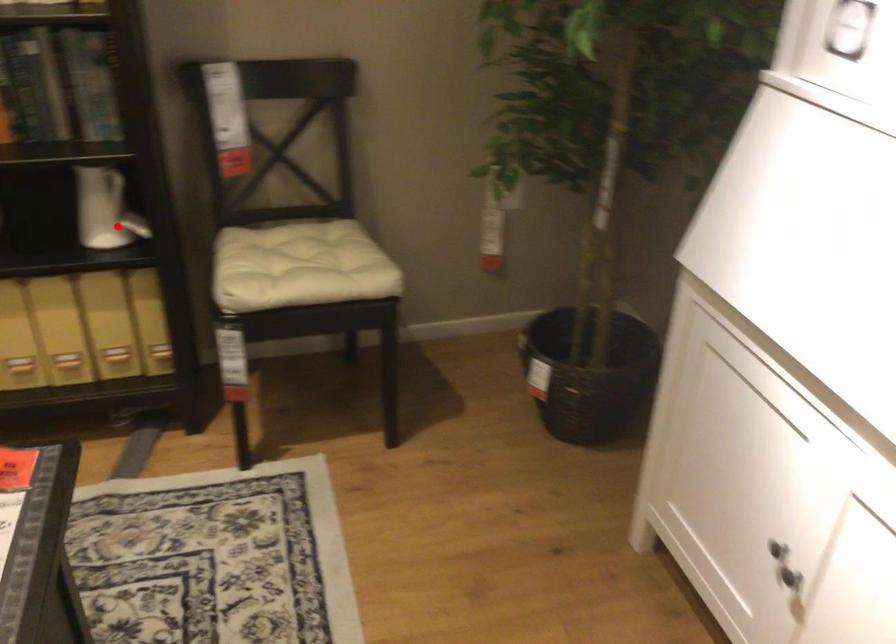
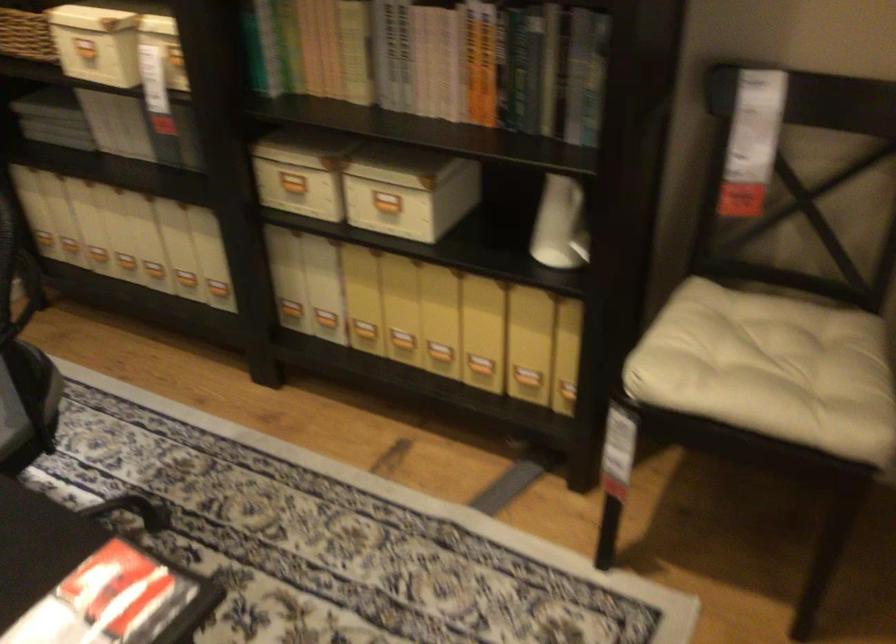
The point at the highlighted location is marked in the first image. Where is the corresponding point in the second image?

(582, 238)